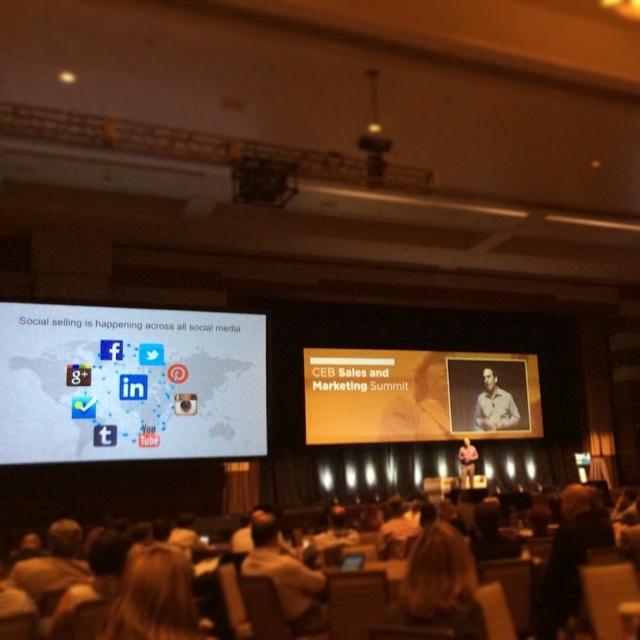
Between orange matte projection screen at center and blonde hair at lower left, which one has more height?

orange matte projection screen at center is taller.

Is orange matte projection screen at center bigger than blonde hair at lower left?

Answer: Indeed, orange matte projection screen at center has a larger size compared to blonde hair at lower left.

You are a GUI agent. You are given a task and a screenshot of the screen. Output one action in this format:
    pyautogui.click(x=<x>, y=<y>)
    Task: Click on the orange matte projection screen at center
    
    Given the screenshot: What is the action you would take?
    pyautogui.click(x=419, y=396)

Based on the photo, between blonde hair at lower center and light brown leather jacket at lower center, which one has less height?

Standing shorter between the two is blonde hair at lower center.

Who is more distant from viewer, (468, 573) or (266, 557)?

Point (266, 557)

At what (x,y) coordinates should I click in order to perform the action: click on blonde hair at lower center. Please return your answer as a coordinate pair (x, y). Looking at the image, I should click on (440, 584).

Does blonde hair at lower center appear under blonde hair at lower left?

Yes.

Is blonde hair at lower center positioned behind blonde hair at lower left?

That is True.

Does point (408, 612) come behind point (124, 580)?

Yes, it is.

You are a GUI agent. You are given a task and a screenshot of the screen. Output one action in this format:
    pyautogui.click(x=<x>, y=<y>)
    Task: Click on the blonde hair at lower center
    The image size is (640, 640).
    Given the screenshot: What is the action you would take?
    pyautogui.click(x=440, y=584)